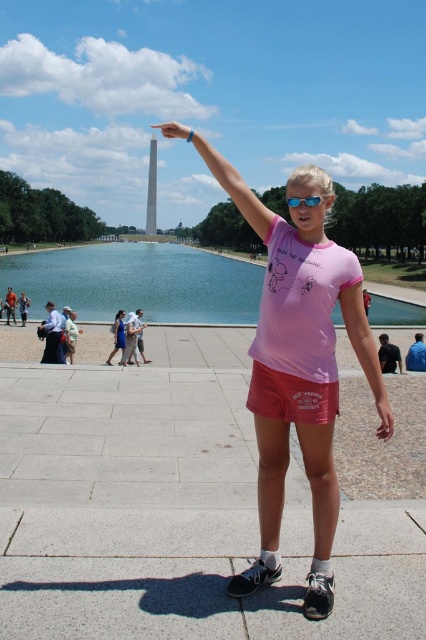
Can you confirm if pink matte t-shirt at center is smaller than matte silver monument at upper center?

Indeed, pink matte t-shirt at center has a smaller size compared to matte silver monument at upper center.

Does pink matte t-shirt at center have a lesser width compared to matte silver monument at upper center?

Yes, pink matte t-shirt at center is thinner than matte silver monument at upper center.

Does point (284, 244) come in front of point (170, 129)?

Yes, point (284, 244) is closer to viewer.

This screenshot has width=426, height=640. Identify the location of pink matte t-shirt at center. (298, 365).

Based on the photo, is pink matte t-shirt at center below clear water at center?

Indeed, pink matte t-shirt at center is positioned under clear water at center.

Is pink matte t-shirt at center positioned at the back of clear water at center?

No.

Is point (270, 461) positioned after point (109, 273)?

That is False.

This screenshot has width=426, height=640. Find the location of `pink matte t-shirt at center`. pink matte t-shirt at center is located at coordinates click(298, 365).

Does clear water at center have a lesser height compared to matte silver monument at upper center?

Correct, clear water at center is not as tall as matte silver monument at upper center.

Describe the element at coordinates (138, 282) in the screenshot. I see `clear water at center` at that location.

Find the location of a particular element. This screenshot has height=640, width=426. clear water at center is located at coordinates (138, 282).